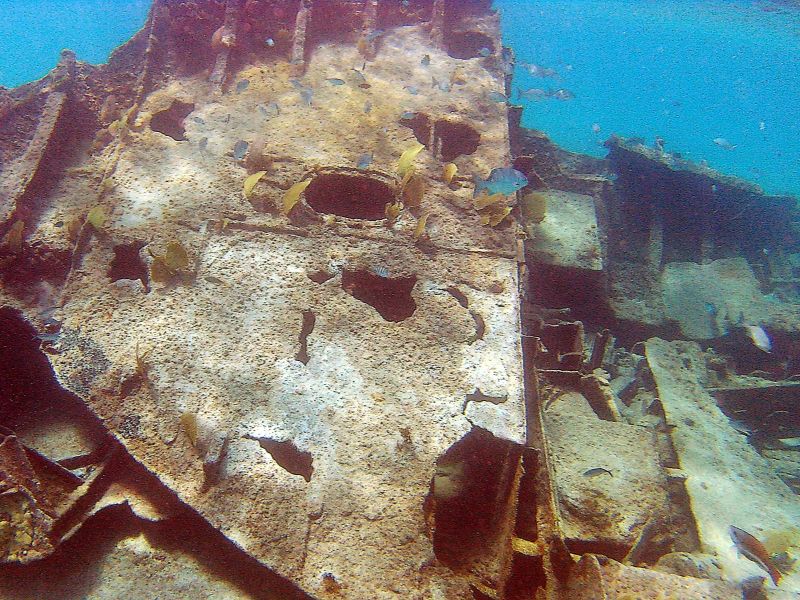
Find the location of a particular element. vertical wooden bar toward right is located at coordinates (658, 251), (710, 248).